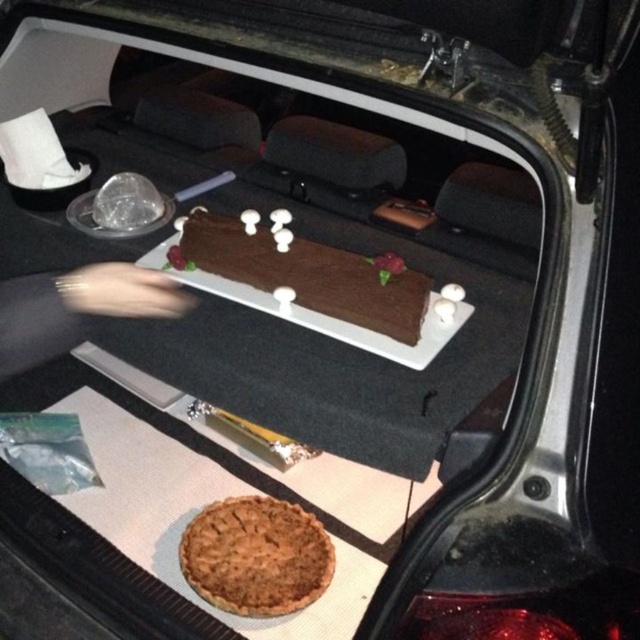
Looking at this image, can you confirm if golden brown flaky pie at lower center is positioned below chocolate matte at center?

Yes, golden brown flaky pie at lower center is below chocolate matte at center.

Is point (212, 552) farther from camera compared to point (342, 310)?

Yes, it is behind point (342, 310).

The image size is (640, 640). What are the coordinates of `golden brown flaky pie at lower center` in the screenshot? It's located at (257, 556).